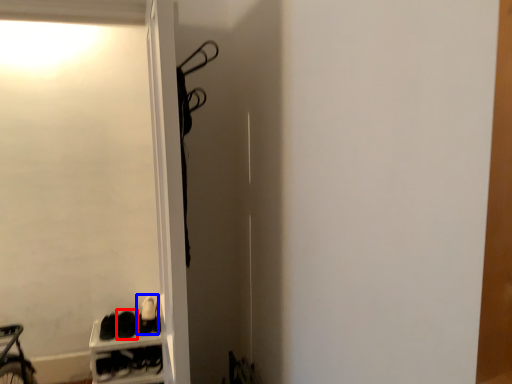
Question: Which point is closer to the camera, footwear (highlighted by a red box) or footwear (highlighted by a blue box)?

Choices:
 (A) footwear
 (B) footwear

Answer: (A)